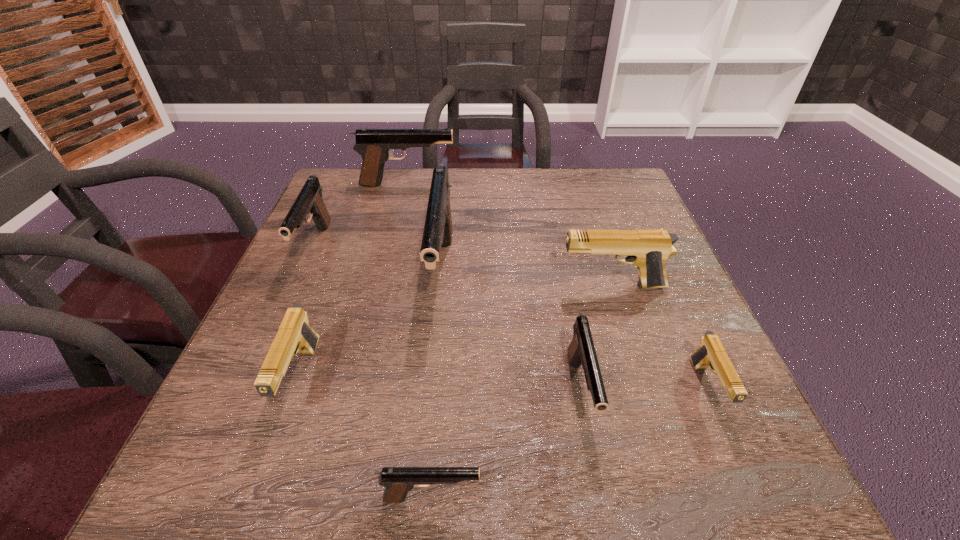
I want to click on the farthest black pistol, so (374, 145).

Find the location of a particular element. The width and height of the screenshot is (960, 540). the farthest pistol is located at coordinates (374, 145).

You are a GUI agent. You are given a task and a screenshot of the screen. Output one action in this format:
    pyautogui.click(x=<x>, y=<y>)
    Task: Click on the farthest tan pistol
    The height and width of the screenshot is (540, 960).
    Given the screenshot: What is the action you would take?
    pyautogui.click(x=647, y=249)

Image resolution: width=960 pixels, height=540 pixels. Identify the location of the leftmost pistol. (309, 201).

The height and width of the screenshot is (540, 960). Identify the location of the third biggest black pistol. (309, 201).

The height and width of the screenshot is (540, 960). What are the coordinates of `the second biggest tan pistol` in the screenshot? It's located at [x=295, y=335].

I want to click on the second nearest black pistol, so click(x=581, y=350).

I want to click on the fourth biggest black pistol, so click(x=581, y=350).

The image size is (960, 540). What are the coordinates of `the smallest tan pistol` in the screenshot? It's located at (711, 353).

Locate an element on the screen. The width and height of the screenshot is (960, 540). the nearest object is located at coordinates (398, 481).